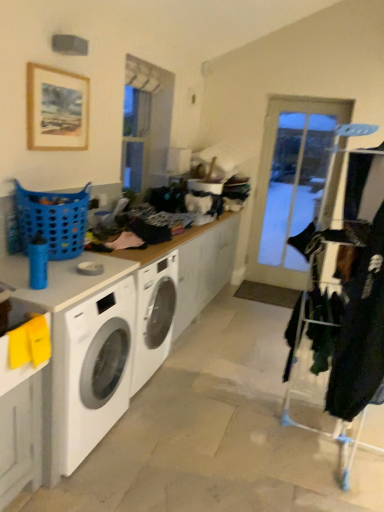
The width and height of the screenshot is (384, 512). I want to click on vacant space that is to the left of metal/textured clothes rack at right, so (x=221, y=426).